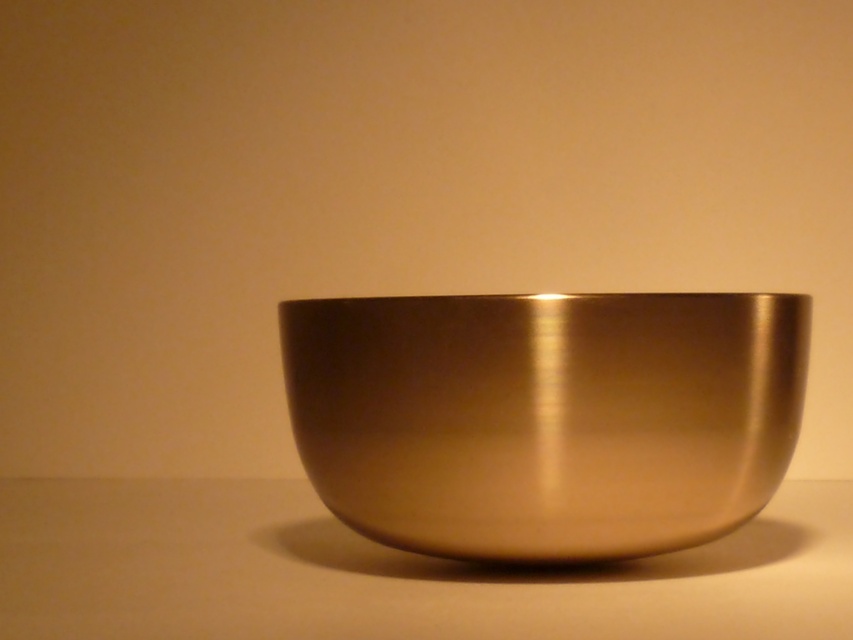
Which is in front, point (521, 426) or point (437, 596)?

Point (521, 426)

Which is behind, point (605, 557) or point (85, 492)?

The point (85, 492) is behind.

I want to click on gold metallic bowl at center, so click(x=544, y=417).

What are the coordinates of `gold metallic bowl at center` in the screenshot? It's located at point(544,417).